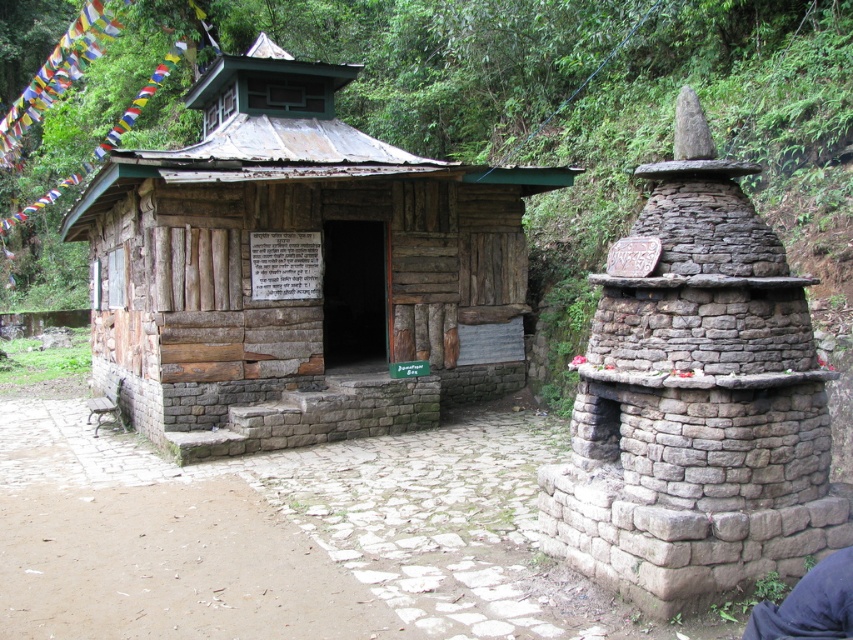
The height and width of the screenshot is (640, 853). Identify the location of rustic wooden hut at center. (299, 269).

Does rustic wooden hut at center have a lesser height compared to dark blue fabric at lower right?

No, rustic wooden hut at center is not shorter than dark blue fabric at lower right.

Between point (412, 372) and point (821, 634), which one is positioned in front?

Point (821, 634) is in front.

Where is `rustic wooden hut at center`? rustic wooden hut at center is located at coordinates (299, 269).